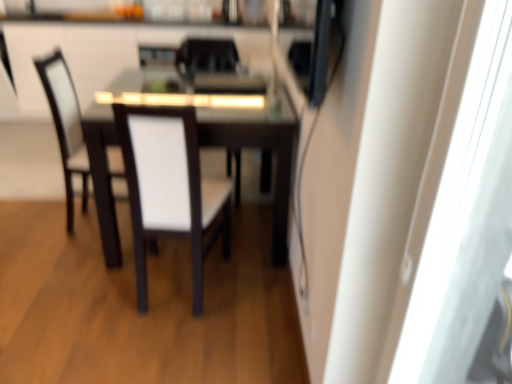
Where is `vacant space positioned to the left of white fabric chair at center, marked as the third chair in a back-to-front arrangement`? This screenshot has height=384, width=512. vacant space positioned to the left of white fabric chair at center, marked as the third chair in a back-to-front arrangement is located at coordinates (37, 219).